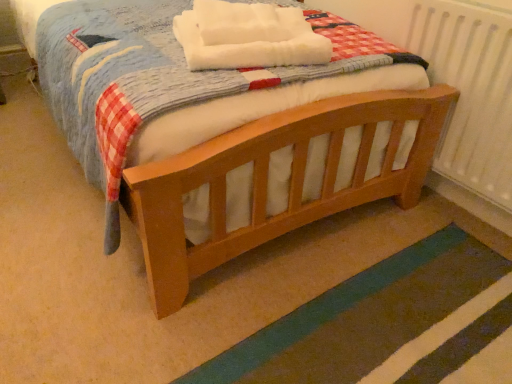
Question: Is white soft blanket at center further to the viewer compared to wooden bed at center?

Choices:
 (A) no
 (B) yes

Answer: (B)

Question: Does white soft blanket at center have a greater height compared to wooden bed at center?

Choices:
 (A) no
 (B) yes

Answer: (B)

Question: Is white soft blanket at center positioned before wooden bed at center?

Choices:
 (A) yes
 (B) no

Answer: (B)

Question: Would you say white soft blanket at center is outside wooden bed at center?

Choices:
 (A) yes
 (B) no

Answer: (A)

Question: From a real-world perspective, is white soft blanket at center located higher than wooden bed at center?

Choices:
 (A) no
 (B) yes

Answer: (B)

Question: Is wooden bed at center in front of or behind teal rug at lower right in the image?

Choices:
 (A) behind
 (B) front

Answer: (B)

Question: Based on their positions, is wooden bed at center located to the left or right of teal rug at lower right?

Choices:
 (A) right
 (B) left

Answer: (B)

Question: Considering the positions of wooden bed at center and teal rug at lower right in the image, is wooden bed at center taller or shorter than teal rug at lower right?

Choices:
 (A) tall
 (B) short

Answer: (B)

Question: From a real-world perspective, is wooden bed at center above or below teal rug at lower right?

Choices:
 (A) below
 (B) above

Answer: (A)

Question: From the image's perspective, is white soft blanket at center positioned above or below teal rug at lower right?

Choices:
 (A) below
 (B) above

Answer: (B)

Question: Is point (268, 14) closer or farther from the camera than point (344, 372)?

Choices:
 (A) closer
 (B) farther

Answer: (B)

Question: In the image, is white soft blanket at center positioned in front of or behind teal rug at lower right?

Choices:
 (A) front
 (B) behind

Answer: (B)

Question: Would you say white soft blanket at center is to the left or to the right of teal rug at lower right in the picture?

Choices:
 (A) right
 (B) left

Answer: (B)

Question: In terms of width, does white soft blanket at center look wider or thinner when compared to wooden bed at center?

Choices:
 (A) thin
 (B) wide

Answer: (A)

Question: From the image's perspective, is white soft blanket at center above or below wooden bed at center?

Choices:
 (A) above
 (B) below

Answer: (A)